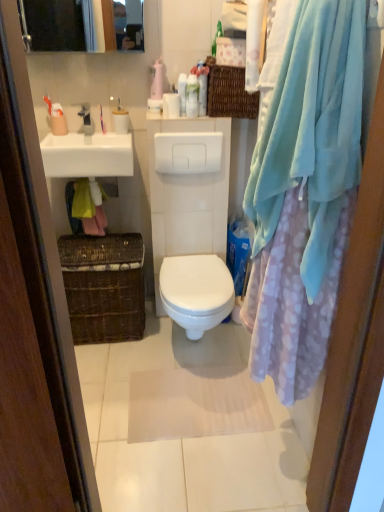
This screenshot has width=384, height=512. What are the coordinates of `free spot to the left of white textured bath mat at center` in the screenshot? It's located at (111, 391).